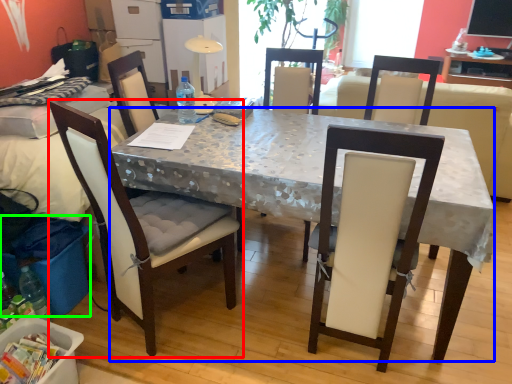
Question: Considering the real-world distances, which object is farthest from chair (highlighted by a red box)? desk (highlighted by a blue box) or trash bin/can (highlighted by a green box)?

Choices:
 (A) desk
 (B) trash bin/can

Answer: (A)